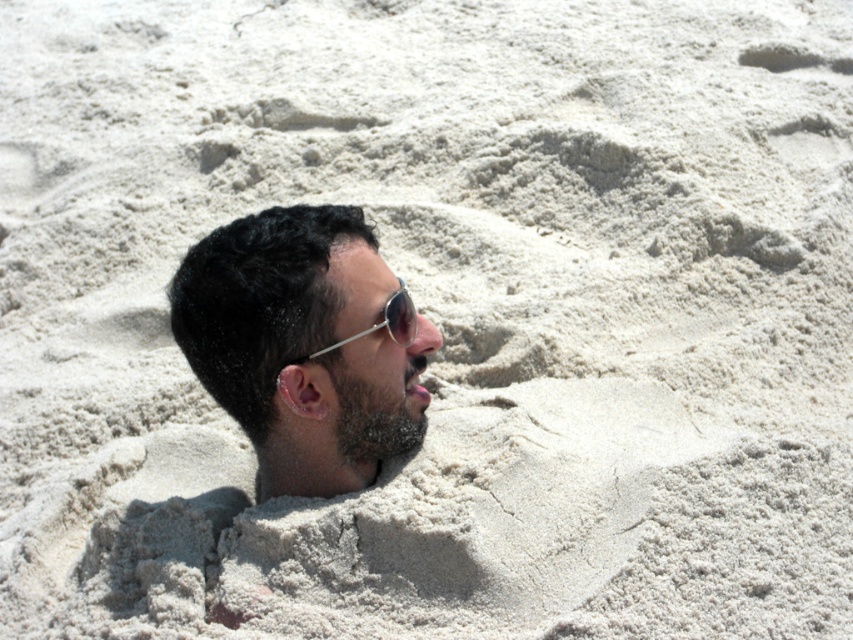
You are a photographer taking a portrait of the person at the beach. You want to ensure that the dark brown hair at center and the metallic reflective sunglasses at center are both clearly visible in the photo. Based on their positions, which object should you focus on first to ensure both are in focus?

The dark brown hair at center is to the left of metallic reflective sunglasses at center. To ensure both are in focus, you should focus on the metallic reflective sunglasses at center first since it is closer to the camera, allowing the dark brown hair at center to also be in focus within the depth of field.

You are a photographer trying to capture a closeup shot of the person in the sand. You need to decide which object, the dark brown hair at center or the metallic reflective sunglasses at center, will occupy more space in your photo. Which one will be larger?

The dark brown hair at center is bigger than the metallic reflective sunglasses at center, so it will occupy more space in the photo.